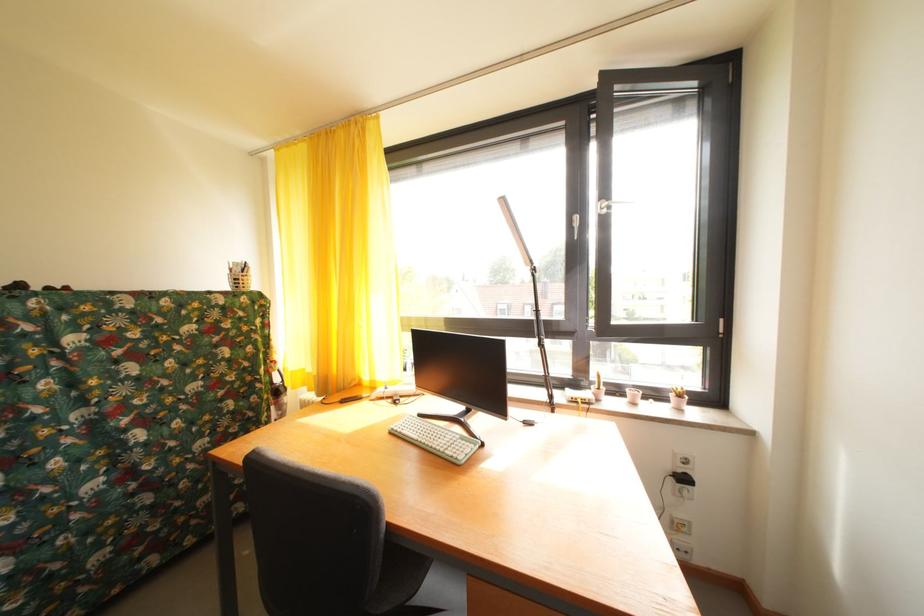
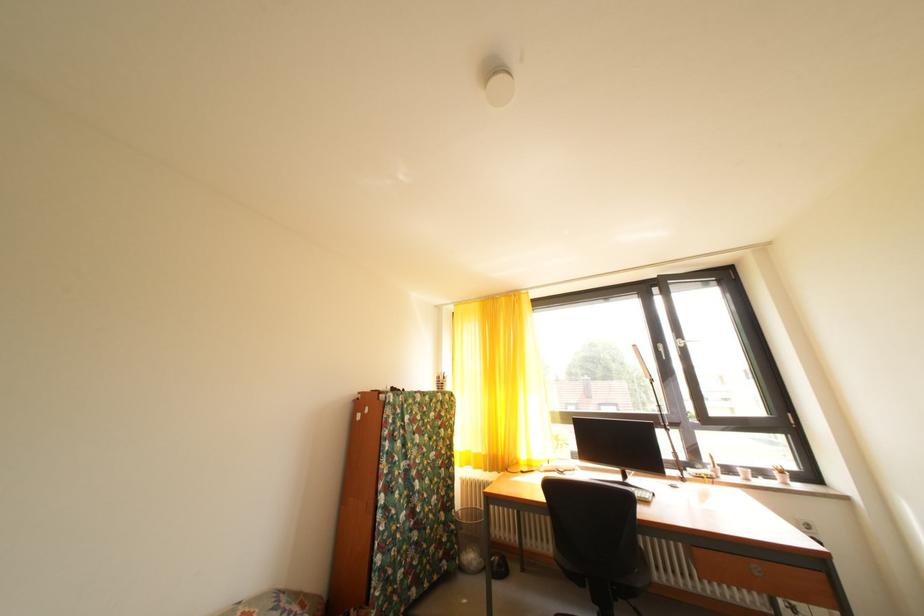
Where in the second image is the point corresponding to pixel 681 400 from the first image?

(784, 479)